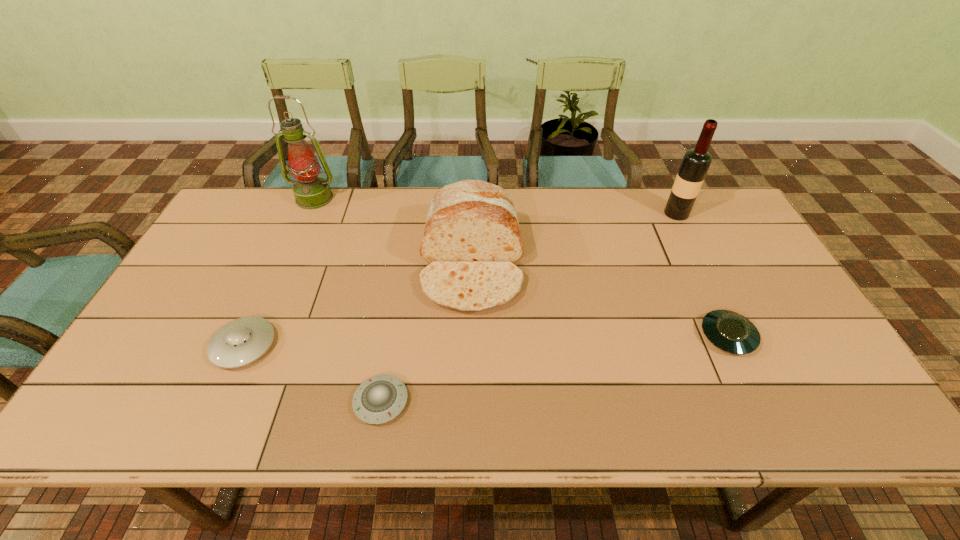
This screenshot has height=540, width=960. In order to click on oil lamp in this screenshot , I will do `click(311, 191)`.

Locate an element on the screen. The image size is (960, 540). wine bottle is located at coordinates (695, 163).

At what (x,y) coordinates should I click in order to perform the action: click on the third tallest object. Please return your answer as a coordinate pair (x, y). The image size is (960, 540). Looking at the image, I should click on (471, 239).

Locate an element on the screen. the leftmost saucer is located at coordinates (242, 341).

This screenshot has width=960, height=540. Identify the location of the rightmost saucer. (731, 332).

The image size is (960, 540). In order to click on the second saucer from left to right in this screenshot , I will do `click(379, 399)`.

Where is `the shortest object`? the shortest object is located at coordinates (379, 399).

Locate an element on the screen. Image resolution: width=960 pixels, height=540 pixels. vacant region located on the left of the oil lamp is located at coordinates (261, 198).

Find the location of a particular element. This screenshot has width=960, height=540. free point located on the right of the wine bottle is located at coordinates (707, 213).

Locate an element on the screen. Image resolution: width=960 pixels, height=540 pixels. vacant space situated 0.250m at the sliced end of the bread is located at coordinates (469, 406).